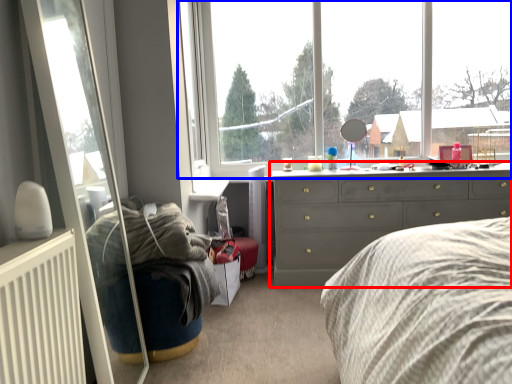
Question: Which of the following is the farthest to the observer, chest of drawers (highlighted by a red box) or window (highlighted by a blue box)?

Choices:
 (A) chest of drawers
 (B) window

Answer: (B)